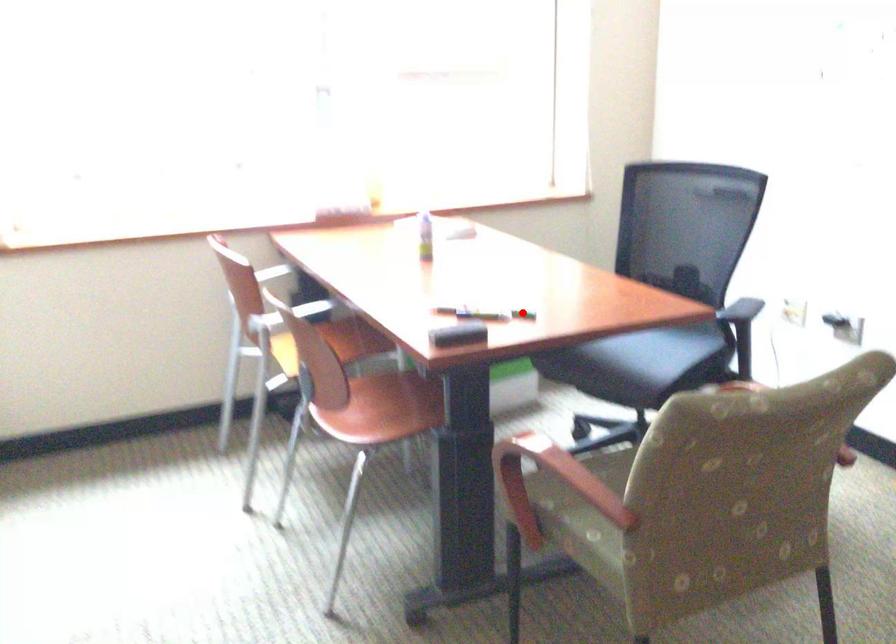
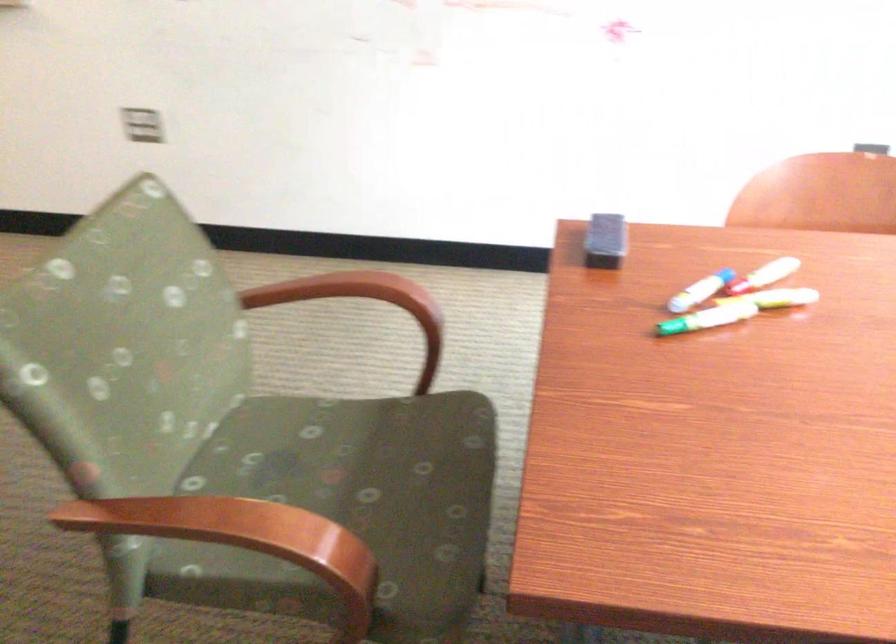
Locate, in the second image, the point that corresponds to the highlighted location in the first image.

(675, 327)